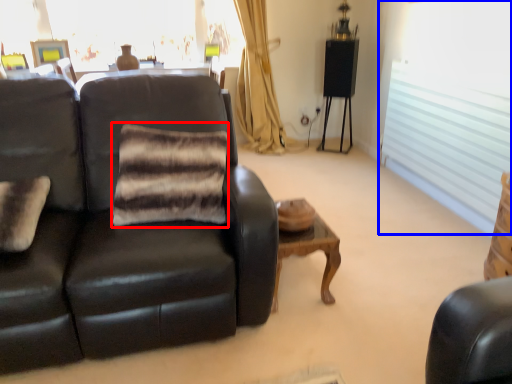
Question: Which of the following is the closest to the observer, pillow (highlighted by a red box) or window (highlighted by a blue box)?

Choices:
 (A) pillow
 (B) window

Answer: (A)